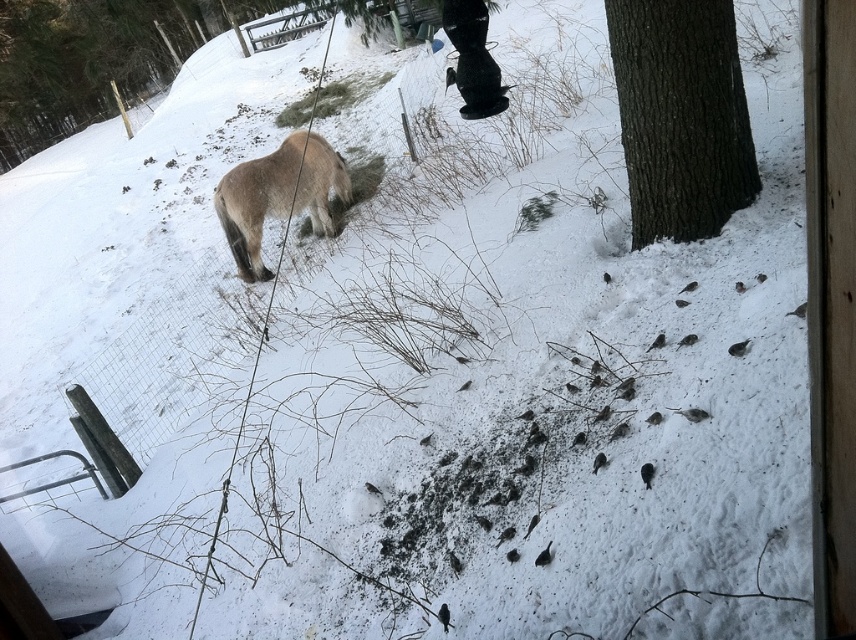
You are standing inside the building looking out the window. You see two points marked on the glass. The first point is at coordinate point(628, 145) and the second is at point(311, 163). Which point is closer to you?

Point(628, 145) is in front of point(311, 163), so the first point is closer to you.

You are an animal trainer observing the snowy outdoor scene through the window. You notice the dark brown bark at right and the fuzzy brown pony at upper left. Which object is narrower in width?

The dark brown bark at right has a lesser width compared to the fuzzy brown pony at upper left, so the dark brown bark at right is narrower in width.

Looking at this image, based on the scene description, what is located at the coordinate point specified as point [681,116]?

The point [681,116] corresponds to dark brown bark at right.